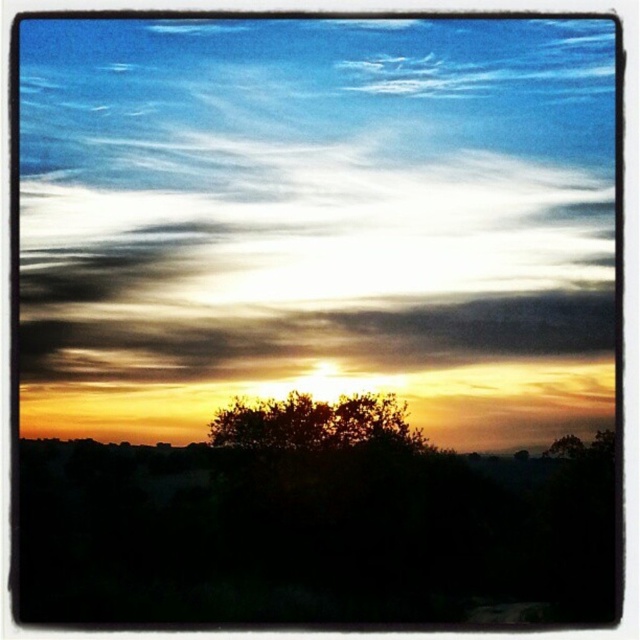
Does soft white clouds at upper center have a lesser width compared to dark green leafy tree at center?

In fact, soft white clouds at upper center might be wider than dark green leafy tree at center.

Based on the photo, which of these two, soft white clouds at upper center or dark green leafy tree at center, stands shorter?

Standing shorter between the two is dark green leafy tree at center.

Where is `soft white clouds at upper center`? The width and height of the screenshot is (640, 640). soft white clouds at upper center is located at coordinates (307, 257).

I want to click on soft white clouds at upper center, so click(307, 257).